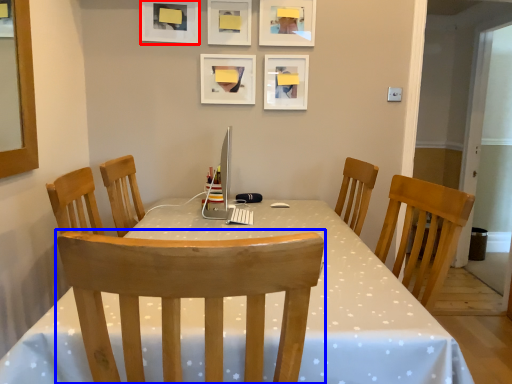
Question: Which object appears closest to the camera in this image, picture frame (highlighted by a red box) or chair (highlighted by a blue box)?

Choices:
 (A) picture frame
 (B) chair

Answer: (B)